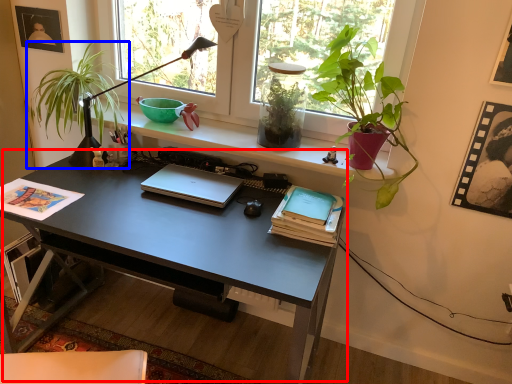
Question: Which object appears farthest to the camera in this image, desk (highlighted by a red box) or houseplant (highlighted by a blue box)?

Choices:
 (A) desk
 (B) houseplant

Answer: (B)